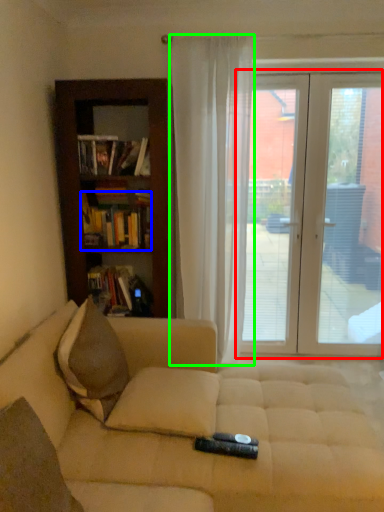
Question: Considering the real-world distances, which object is farthest from door (highlighted by a red box)? book (highlighted by a blue box) or curtain (highlighted by a green box)?

Choices:
 (A) book
 (B) curtain

Answer: (A)